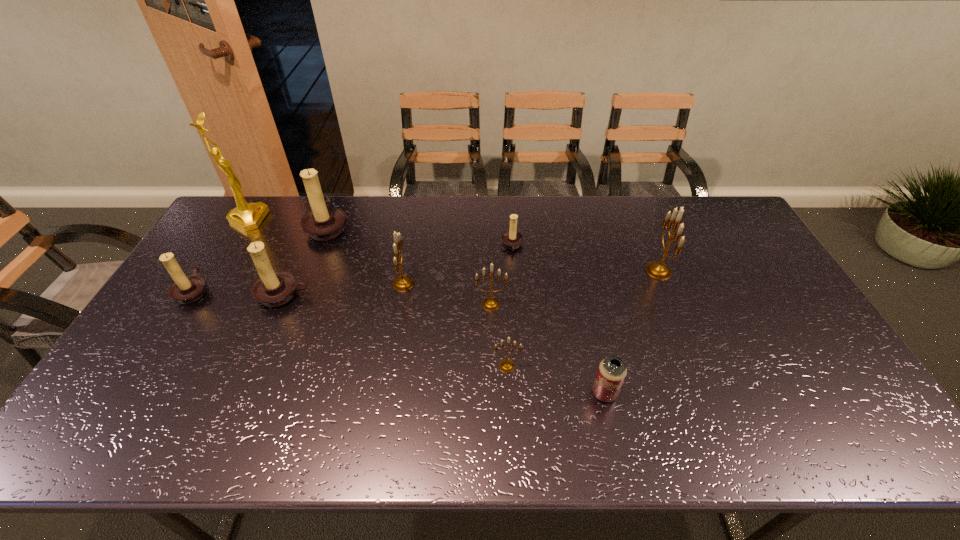
The width and height of the screenshot is (960, 540). I want to click on vacant position in the image that satisfies the following two spatial constraints: 1. on the wick of the rightmost brown candle holder; 2. on the front side of the second smallest gold candelabrum, so click(516, 304).

At what (x,y) coordinates should I click in order to perform the action: click on blank area in the image that satisfies the following two spatial constraints: 1. on the wick of the rightmost brown candle holder; 2. on the front side of the third biggest gold candelabrum. Please return your answer as a coordinate pair (x, y). The height and width of the screenshot is (540, 960). Looking at the image, I should click on (516, 304).